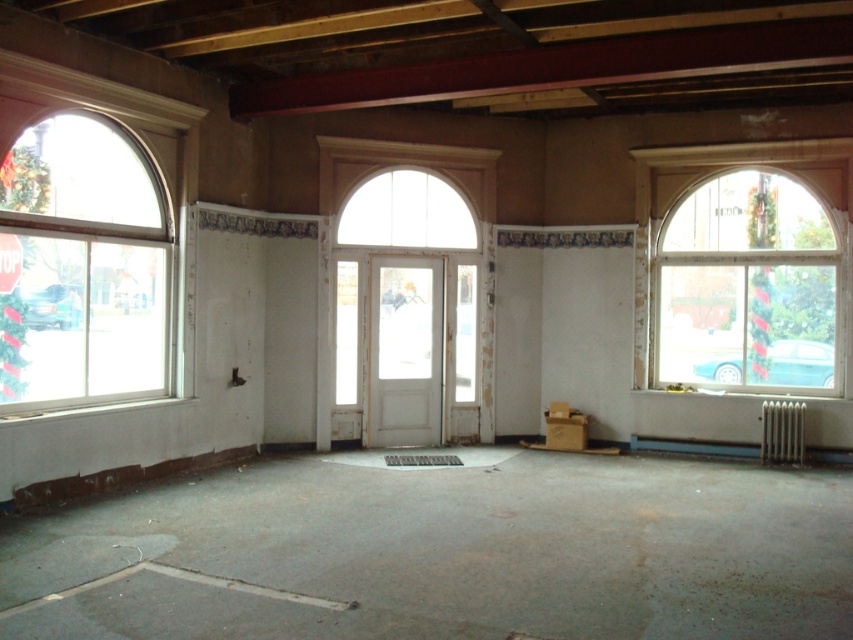
You are standing in the center of the room and want to exit through the nearest window. Which window should you head towards, the white glass window at left or the clear glass window at right?

The white glass window at left is to the left of clear glass window at right, so you should head towards the white glass window at left if you are closer to the left side of the room, or the clear glass window at right if you are closer to the right side. However, since you are standing in the center, both windows are equidistant, so you can choose either.

You are standing in the room and want to let in more natural light. Which window should you clean, the white glass window at left or the clear glass window at right?

The white glass window at left is positioned over the clear glass window at right. Since the white glass window at left is above, cleaning it would allow more light to enter as it is higher up and might not be obstructed by lower structures.